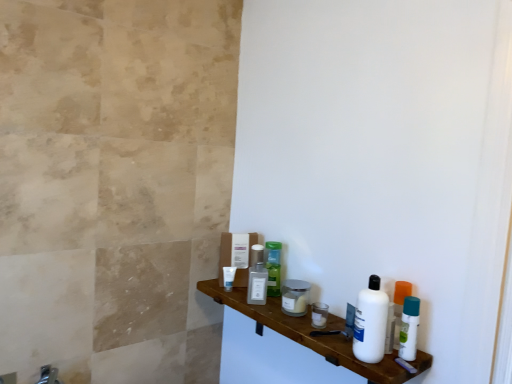
What do you see at coordinates (257, 284) in the screenshot?
I see `satin silver mouthwash at center, acting as the 2th mouthwash starting from the front` at bounding box center [257, 284].

I want to click on satin silver mouthwash at center, which appears as the 1th mouthwash when viewed from the left, so click(x=257, y=284).

This screenshot has height=384, width=512. I want to click on white matte tube at center, which is the fourth toiletry in right-to-left order, so click(x=229, y=277).

Can you confirm if white glossy wood shelf at lower right is bigger than satin silver mouthwash at center, acting as the 2th mouthwash starting from the front?

Yes.

From the picture: From the image's perspective, which one is positioned lower, white glossy wood shelf at lower right or satin silver mouthwash at center, acting as the 2th mouthwash starting from the front?

white glossy wood shelf at lower right, from the image's perspective.

Between white glossy wood shelf at lower right and satin silver mouthwash at center, which appears as the 1th mouthwash when viewed from the left, which one appears on the left side from the viewer's perspective?

Positioned to the left is satin silver mouthwash at center, which appears as the 1th mouthwash when viewed from the left.

Is white glossy wood shelf at lower right next to satin silver mouthwash at center, which appears as the 1th mouthwash when viewed from the left, and touching it?

There is a gap between white glossy wood shelf at lower right and satin silver mouthwash at center, which appears as the 1th mouthwash when viewed from the left.

Identify the location of faucet on the left of the white plastic bottle at right. (48, 375).

Does white plastic bottle at right contain brushed metal faucet at lower left?

No, white plastic bottle at right does not contain brushed metal faucet at lower left.

Is white plastic bottle at right positioned in front of brushed metal faucet at lower left?

Yes, the depth of white plastic bottle at right is less than that of brushed metal faucet at lower left.

From a real-world perspective, is brushed metal faucet at lower left located higher than satin silver mouthwash at center, which appears as the 1th mouthwash when viewed from the left?

No.

Is brushed metal faucet at lower left oriented towards satin silver mouthwash at center, which is the second mouthwash in right-to-left order?

No, brushed metal faucet at lower left is not aimed at satin silver mouthwash at center, which is the second mouthwash in right-to-left order.

Is brushed metal faucet at lower left beside satin silver mouthwash at center, which appears as the 1th mouthwash when viewed from the left?

No, brushed metal faucet at lower left is not making contact with satin silver mouthwash at center, which appears as the 1th mouthwash when viewed from the left.

Considering the sizes of objects brushed metal faucet at lower left and satin silver mouthwash at center, which appears as the 1th mouthwash when viewed from the left, in the image provided, who is smaller, brushed metal faucet at lower left or satin silver mouthwash at center, which appears as the 1th mouthwash when viewed from the left,?

satin silver mouthwash at center, which appears as the 1th mouthwash when viewed from the left, is smaller.

Could you tell me if brushed metal faucet at lower left is facing white plastic bottle at right, which appears as the first mouthwash when viewed from the right?

No, brushed metal faucet at lower left is not turned towards white plastic bottle at right, which appears as the first mouthwash when viewed from the right.

Can you confirm if brushed metal faucet at lower left is wider than white plastic bottle at right, which appears as the first mouthwash when viewed from the right?

Correct, the width of brushed metal faucet at lower left exceeds that of white plastic bottle at right, which appears as the first mouthwash when viewed from the right.

Is brushed metal faucet at lower left completely or partially outside of white plastic bottle at right, which appears as the second mouthwash when viewed from the back?

That's correct, brushed metal faucet at lower left is outside of white plastic bottle at right, which appears as the second mouthwash when viewed from the back.

How far apart are white matte tube at center, which is the fourth toiletry in right-to-left order, and metallic silver jar at center, marked as the 1th toiletry in a front-to-back arrangement?

white matte tube at center, which is the fourth toiletry in right-to-left order, is 37.23 centimeters from metallic silver jar at center, marked as the 1th toiletry in a front-to-back arrangement.

Which is in front, white matte tube at center, the 1th toiletry viewed from the back, or metallic silver jar at center, which ranks as the fourth toiletry in left-to-right order?

Positioned in front is metallic silver jar at center, which ranks as the fourth toiletry in left-to-right order.

From the image's perspective, between white matte tube at center, the 1th toiletry viewed from the back, and metallic silver jar at center, marked as the 4th toiletry in a back-to-front arrangement, which one is located above?

white matte tube at center, the 1th toiletry viewed from the back.

Is white matte tube at center, which is the fourth toiletry in right-to-left order, looking in the opposite direction of metallic silver jar at center, which ranks as the first toiletry in right-to-left order?

white matte tube at center, which is the fourth toiletry in right-to-left order, is not turned away from metallic silver jar at center, which ranks as the first toiletry in right-to-left order.

How much distance is there between clear glass jar at center, positioned as the 3th toiletry in left-to-right order, and white matte tube at center, which is the fourth toiletry in right-to-left order?

clear glass jar at center, positioned as the 3th toiletry in left-to-right order, is 25.99 centimeters away from white matte tube at center, which is the fourth toiletry in right-to-left order.

Considering the sizes of clear glass jar at center, the 2th toiletry positioned from the front, and white matte tube at center, acting as the 4th toiletry starting from the front, in the image, is clear glass jar at center, the 2th toiletry positioned from the front, wider or thinner than white matte tube at center, acting as the 4th toiletry starting from the front,?

In the image, clear glass jar at center, the 2th toiletry positioned from the front, appears to be wider than white matte tube at center, acting as the 4th toiletry starting from the front.

Is clear glass jar at center, acting as the 2th toiletry starting from the right, facing towards white matte tube at center, which appears as the 1th toiletry when viewed from the left?

No, clear glass jar at center, acting as the 2th toiletry starting from the right, is not turned towards white matte tube at center, which appears as the 1th toiletry when viewed from the left.

Is clear glass jar at center, acting as the third toiletry starting from the back, far away from white matte tube at center, which is the fourth toiletry in right-to-left order?

That's not correct — clear glass jar at center, acting as the third toiletry starting from the back, is a little close to white matte tube at center, which is the fourth toiletry in right-to-left order.

Between metallic silver jar at center, marked as the 1th toiletry in a front-to-back arrangement, and white glossy wood shelf at lower right, which one appears on the left side from the viewer's perspective?

white glossy wood shelf at lower right is more to the left.

Can you confirm if metallic silver jar at center, which ranks as the first toiletry in right-to-left order, is thinner than white glossy wood shelf at lower right?

Yes.

Is white glossy wood shelf at lower right a part of metallic silver jar at center, which ranks as the fourth toiletry in left-to-right order?

No, white glossy wood shelf at lower right is not surrounded by metallic silver jar at center, which ranks as the fourth toiletry in left-to-right order.

Is metallic silver jar at center, marked as the 1th toiletry in a front-to-back arrangement, looking in the opposite direction of white glossy wood shelf at lower right?

metallic silver jar at center, marked as the 1th toiletry in a front-to-back arrangement, is not turned away from white glossy wood shelf at lower right.

Which mouthwash is the 2nd one when counting from the back of the white glossy wood shelf at lower right? Please provide its 2D coordinates.

[(257, 284)]

The height and width of the screenshot is (384, 512). I want to click on cleaning product that appears on the right of brushed metal faucet at lower left, so click(370, 323).

Looking at the image, which one is located further to metallic silver jar at center, marked as the 1th toiletry in a front-to-back arrangement, white plastic bottle at right, acting as the second mouthwash starting from the left, or white glossy wood shelf at lower right?

white plastic bottle at right, acting as the second mouthwash starting from the left, lies further to metallic silver jar at center, marked as the 1th toiletry in a front-to-back arrangement, than the other object.

Which object lies further to the anchor point white matte tube at center, acting as the 4th toiletry starting from the front, metallic silver jar at center, which ranks as the first toiletry in right-to-left order, or satin silver mouthwash at center, which appears as the 1th mouthwash when viewed from the left?

metallic silver jar at center, which ranks as the first toiletry in right-to-left order, is positioned further to the anchor white matte tube at center, acting as the 4th toiletry starting from the front.

Which object lies nearer to the anchor point clear glass jar at center, positioned as the 3th toiletry in left-to-right order, metallic silver jar at center, marked as the 1th toiletry in a front-to-back arrangement, or satin silver mouthwash at center, which is the second mouthwash in right-to-left order?

metallic silver jar at center, marked as the 1th toiletry in a front-to-back arrangement.

Which object lies nearer to the anchor point satin silver mouthwash at center, which is the second mouthwash in right-to-left order, white matte tube at center, which appears as the 1th toiletry when viewed from the left, or metallic silver jar at center, which ranks as the fourth toiletry in left-to-right order?

white matte tube at center, which appears as the 1th toiletry when viewed from the left.

Based on their spatial positions, is metallic silver jar at center, which ranks as the first toiletry in right-to-left order, or brushed metal faucet at lower left further from white plastic bottle at right?

brushed metal faucet at lower left is positioned further to the anchor white plastic bottle at right.

Estimate the real-world distances between objects in this image. Which object is further from metallic silver jar at center, marked as the 4th toiletry in a back-to-front arrangement, green plastic bottle at center, which ranks as the third toiletry in front-to-back order, or clear glass jar at center, positioned as the 3th toiletry in left-to-right order?

Among the two, green plastic bottle at center, which ranks as the third toiletry in front-to-back order, is located further to metallic silver jar at center, marked as the 4th toiletry in a back-to-front arrangement.

Which object lies further to the anchor point clear glass jar at center, acting as the 2th toiletry starting from the right, satin silver mouthwash at center, which appears as the 1th mouthwash when viewed from the left, or brushed metal faucet at lower left?

brushed metal faucet at lower left lies further to clear glass jar at center, acting as the 2th toiletry starting from the right, than the other object.

Looking at the image, which one is located closer to brushed metal faucet at lower left, white matte tube at center, which is the fourth toiletry in right-to-left order, or white plastic bottle at right, arranged as the 1th mouthwash when viewed from the front?

Among the two, white matte tube at center, which is the fourth toiletry in right-to-left order, is located nearer to brushed metal faucet at lower left.

In order to click on mouthwash positioned between white plastic bottle at right and metallic silver jar at center, which ranks as the first toiletry in right-to-left order, from near to far in this screenshot , I will do pyautogui.click(x=409, y=328).

Find the location of a particular element. cleaning product between white glossy wood shelf at lower right and green plastic bottle at center, acting as the 2th toiletry starting from the left, from front to back is located at coordinates (370, 323).

Find the location of a particular element. This screenshot has width=512, height=384. mouthwash located between white matte tube at center, which appears as the 1th toiletry when viewed from the left, and clear glass jar at center, acting as the third toiletry starting from the back, in the left-right direction is located at coordinates coord(257,284).

I want to click on toiletry between white plastic bottle at right and clear glass jar at center, acting as the 2th toiletry starting from the right, along the z-axis, so click(x=319, y=314).